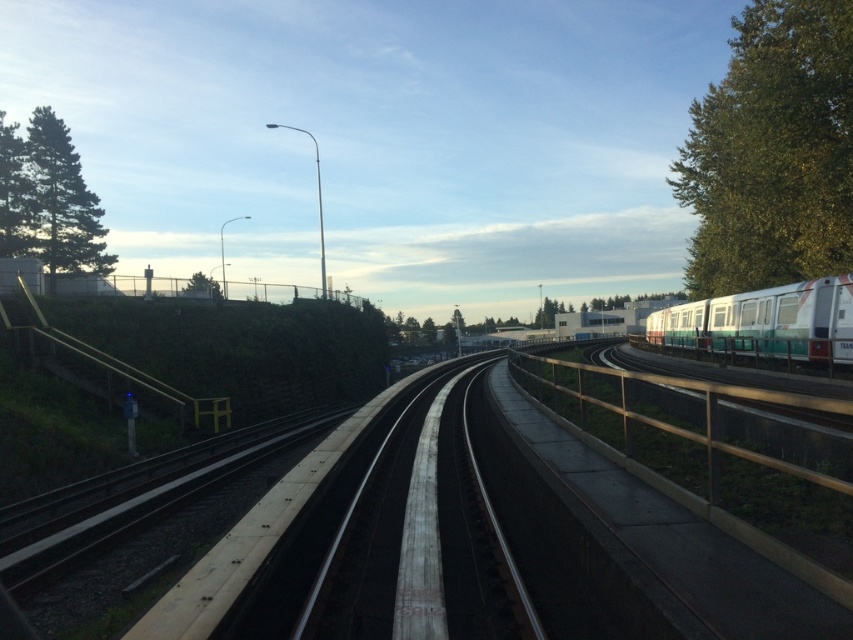
Looking at this image, you are standing at the concrete platform next to the railway tracks and see two points marked on the ground. The first point is at coordinate point (795,141) and the second is at point (67,204). From your position on the platform, which point is closer to you?

Point (795,141) is in front of point (67,204), so it is closer to you.